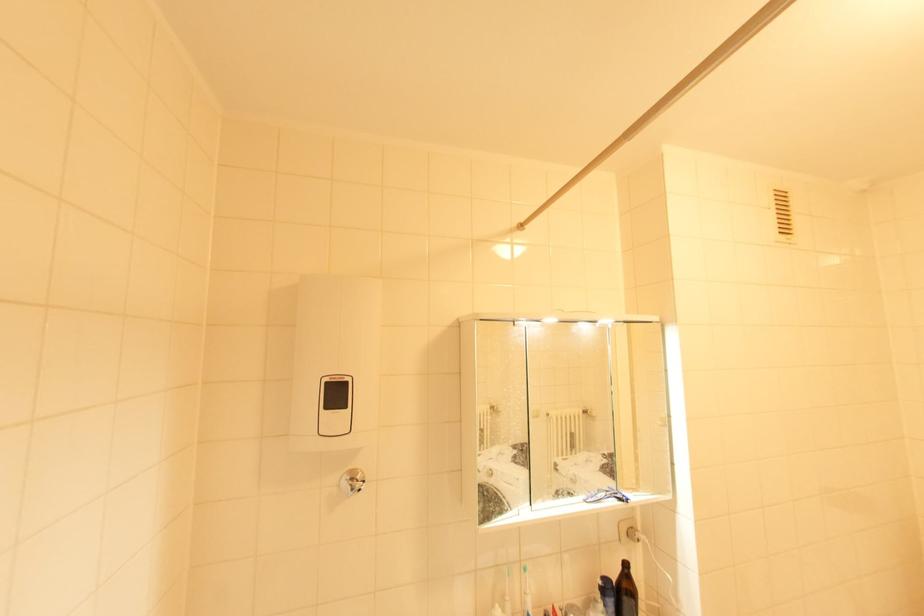
Find where to lift the brown glass bottle. Please return your answer as a coordinate pair (x, y).

(625, 592)